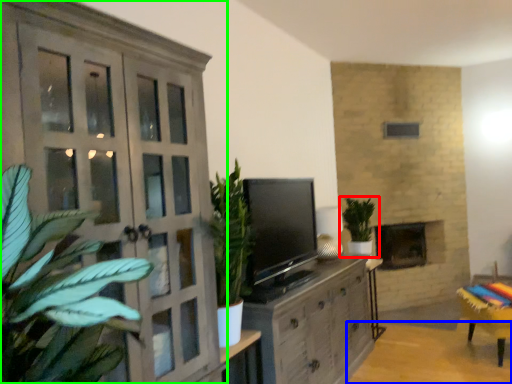
Question: Which object is positioned farthest from houseplant (highlighted by a red box)? Select from table (highlighted by a blue box) and cupboard (highlighted by a green box).

Choices:
 (A) table
 (B) cupboard

Answer: (B)